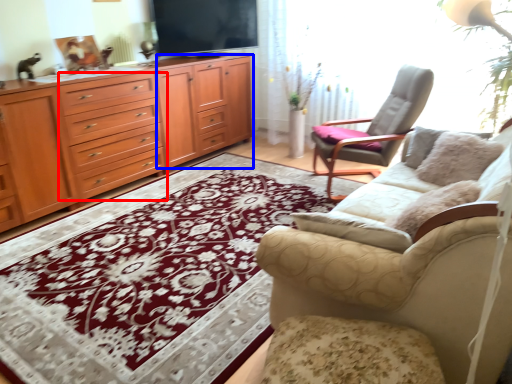
Question: Which of the following is the closest to the observer, drawer (highlighted by a red box) or tv cabinet (highlighted by a blue box)?

Choices:
 (A) drawer
 (B) tv cabinet

Answer: (A)